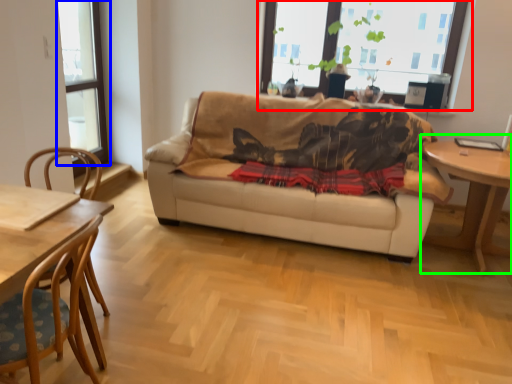
Question: Which object is the farthest from window (highlighted by a red box)? Choose among these: window (highlighted by a blue box) or table (highlighted by a green box).

Choices:
 (A) window
 (B) table

Answer: (A)